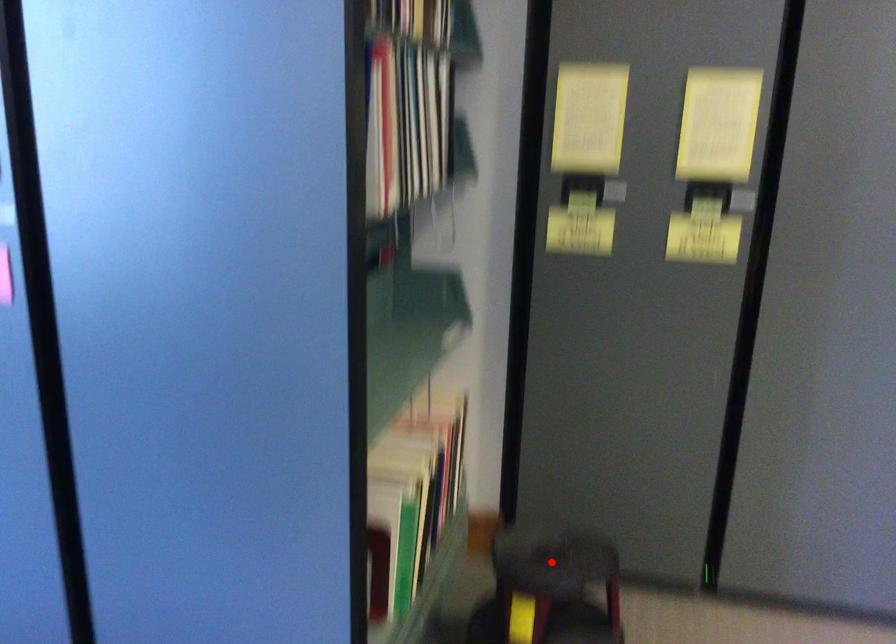
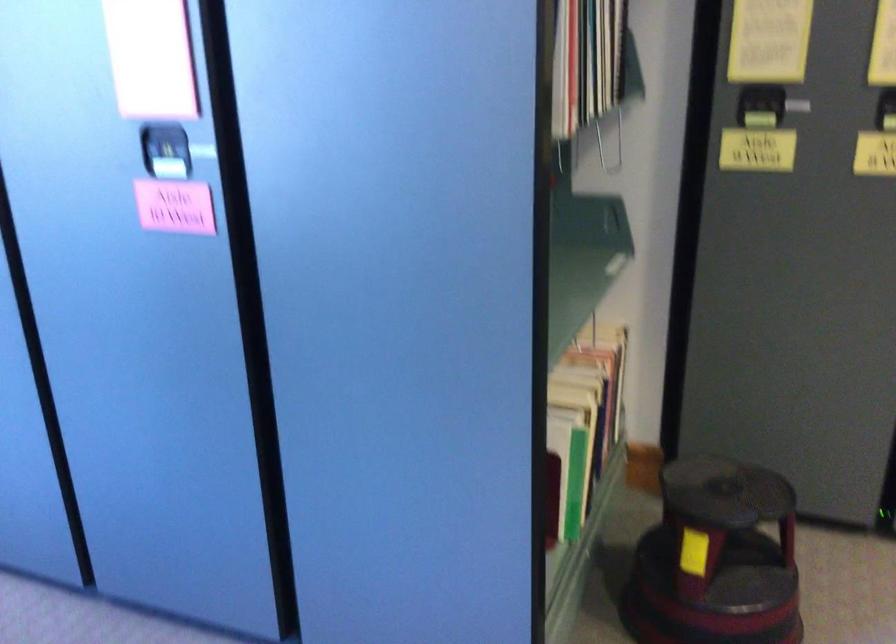
In the second image, find the point that corresponds to the highlighted location in the first image.

(725, 491)